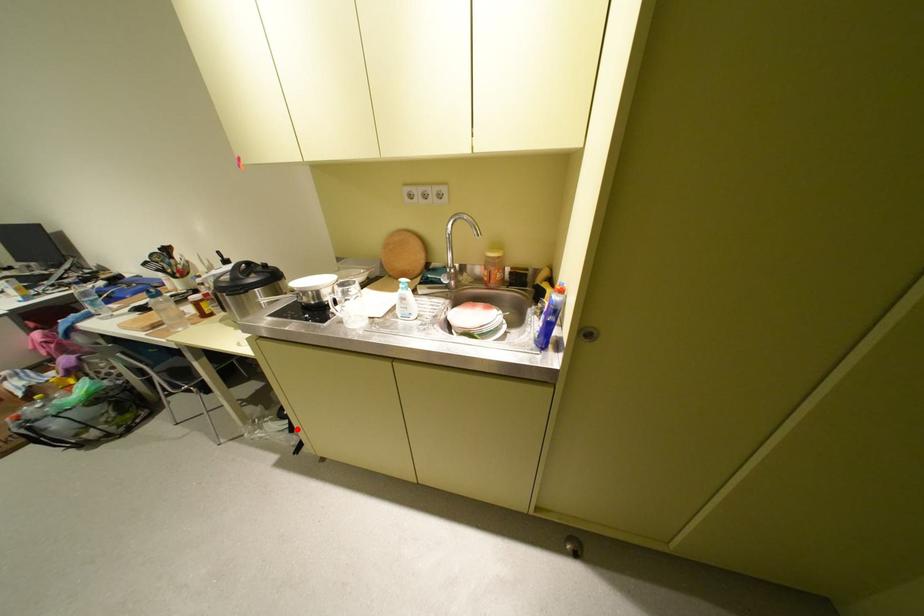
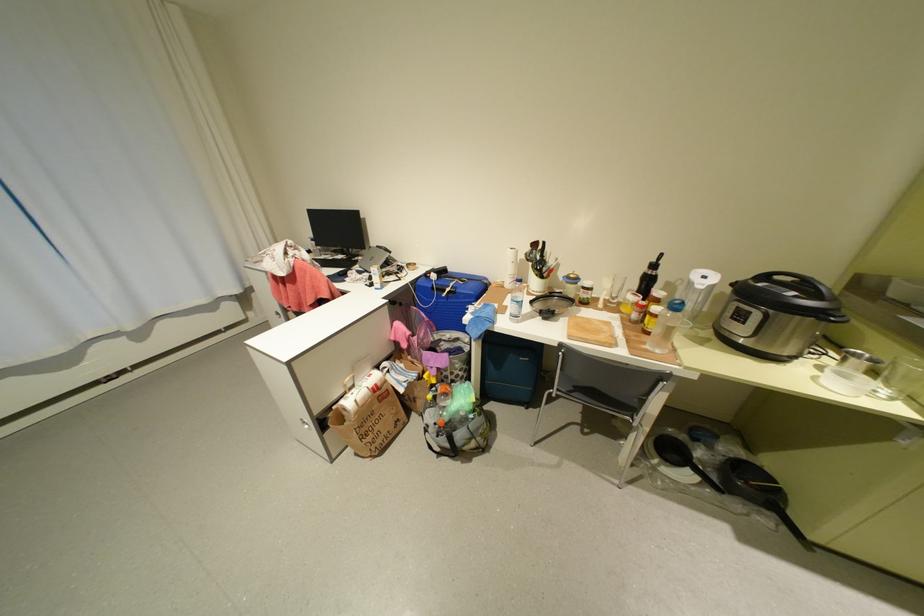
In the second image, find the point that corresponds to the highlighted location in the first image.

(711, 484)